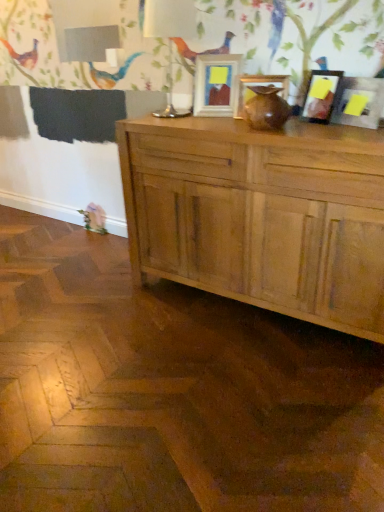
Question: Is the depth of matte wooden picture frame at center, arranged as the 1th picture frame when viewed from the left, less than that of matte wooden picture frame at center, which appears as the 3th picture frame when viewed from the right?

Choices:
 (A) no
 (B) yes

Answer: (A)

Question: Is matte wooden picture frame at center, arranged as the 1th picture frame when viewed from the left, next to matte wooden picture frame at center, which appears as the 3th picture frame when viewed from the right, and touching it?

Choices:
 (A) no
 (B) yes

Answer: (A)

Question: From a real-world perspective, is matte wooden picture frame at center, which is the 4th picture frame in right-to-left order, positioned under matte wooden picture frame at center, acting as the 2th picture frame starting from the left, based on gravity?

Choices:
 (A) yes
 (B) no

Answer: (B)

Question: Is matte wooden picture frame at center, which is the 4th picture frame in right-to-left order, facing away from matte wooden picture frame at center, which appears as the 3th picture frame when viewed from the right?

Choices:
 (A) no
 (B) yes

Answer: (A)

Question: Can you confirm if matte wooden picture frame at center, arranged as the 1th picture frame when viewed from the left, is positioned to the right of matte wooden picture frame at center, which appears as the 3th picture frame when viewed from the right?

Choices:
 (A) no
 (B) yes

Answer: (A)

Question: Visually, is natural wood cabinet at center positioned to the left or to the right of white glossy table lamp at upper center?

Choices:
 (A) left
 (B) right

Answer: (B)

Question: From a real-world perspective, relative to white glossy table lamp at upper center, is natural wood cabinet at center vertically above or below?

Choices:
 (A) above
 (B) below

Answer: (B)

Question: Which is correct: natural wood cabinet at center is inside white glossy table lamp at upper center, or outside of it?

Choices:
 (A) inside
 (B) outside

Answer: (B)

Question: Considering the positions of natural wood cabinet at center and white glossy table lamp at upper center in the image, is natural wood cabinet at center wider or thinner than white glossy table lamp at upper center?

Choices:
 (A) thin
 (B) wide

Answer: (B)

Question: From a real-world perspective, is matte wooden picture frame at center, acting as the 2th picture frame starting from the left, physically located above or below white glossy table lamp at upper center?

Choices:
 (A) above
 (B) below

Answer: (B)

Question: Is matte wooden picture frame at center, acting as the 2th picture frame starting from the left, taller or shorter than white glossy table lamp at upper center?

Choices:
 (A) short
 (B) tall

Answer: (A)

Question: Is matte wooden picture frame at center, acting as the 2th picture frame starting from the left, wider or thinner than white glossy table lamp at upper center?

Choices:
 (A) wide
 (B) thin

Answer: (B)

Question: From the image's perspective, is matte wooden picture frame at center, acting as the 2th picture frame starting from the left, positioned above or below white glossy table lamp at upper center?

Choices:
 (A) above
 (B) below

Answer: (B)

Question: In terms of size, does matte black picture frame at upper right, which ranks as the first picture frame in right-to-left order, appear bigger or smaller than white glossy table lamp at upper center?

Choices:
 (A) big
 (B) small

Answer: (B)

Question: Is matte black picture frame at upper right, the fourth picture frame positioned from the left, taller or shorter than white glossy table lamp at upper center?

Choices:
 (A) short
 (B) tall

Answer: (A)